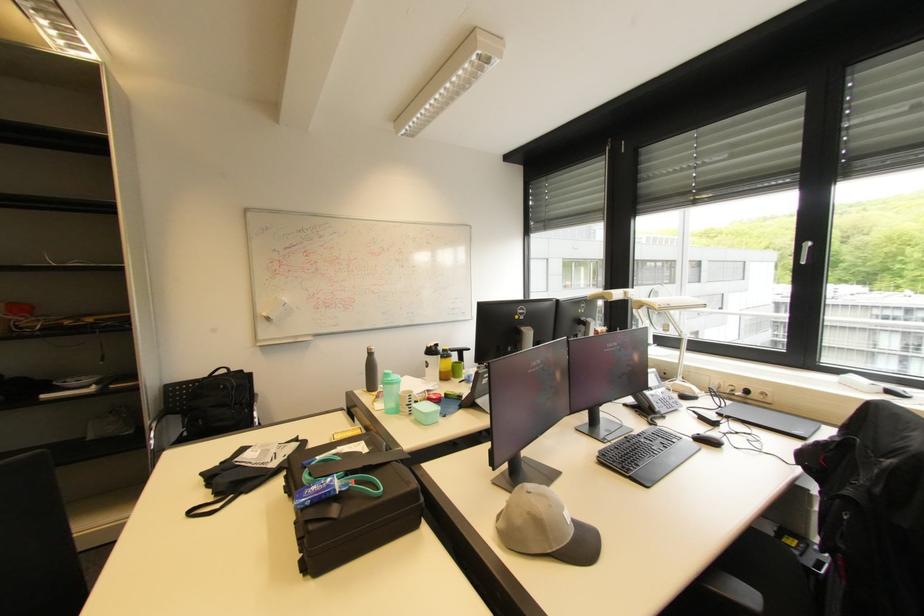
I want to click on black backpack, so click(x=217, y=405).